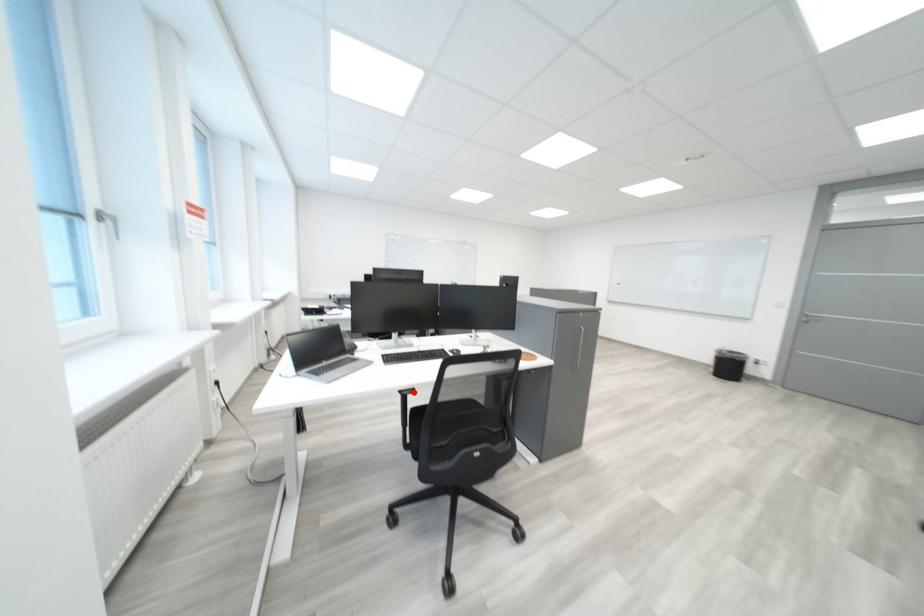
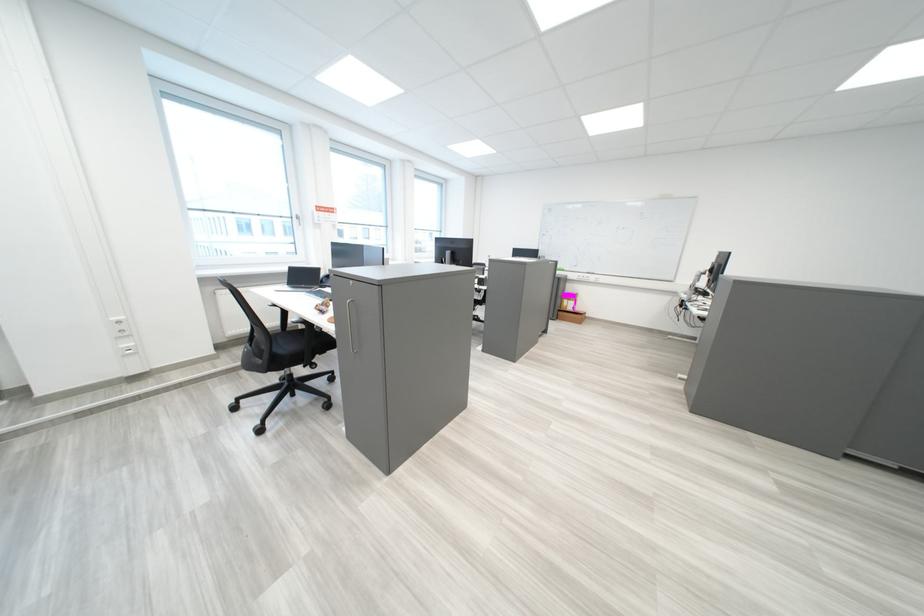
Question: I am providing you with two images of the same scene from different viewpoints. A red point is marked on the first image. Is the red point's position out of view in image 2?

Choices:
 (A) Yes
 (B) No

Answer: (A)